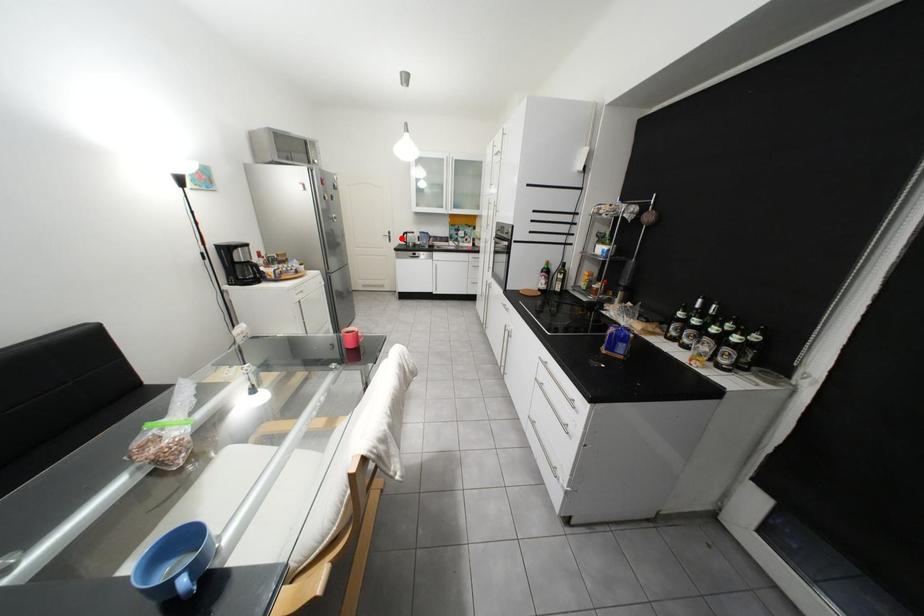
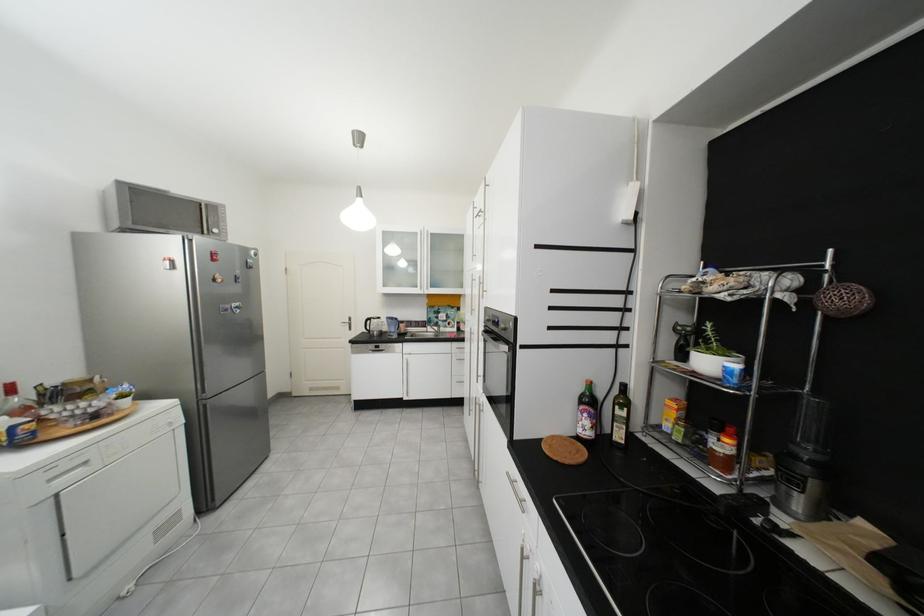
Where in the second image is the point corresponding to the highlighted location from the first image?

(361, 325)